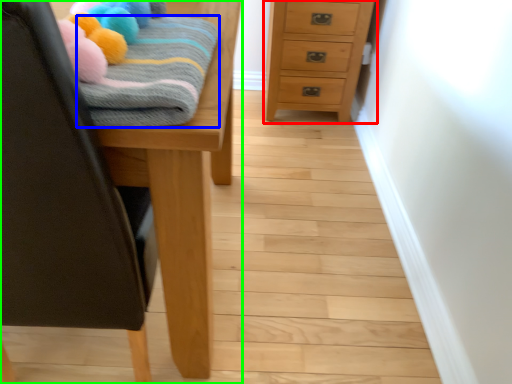
Question: Which is farther away from chest of drawers (highlighted by a red box)? bath towel (highlighted by a blue box) or furniture (highlighted by a green box)?

Choices:
 (A) bath towel
 (B) furniture

Answer: (A)